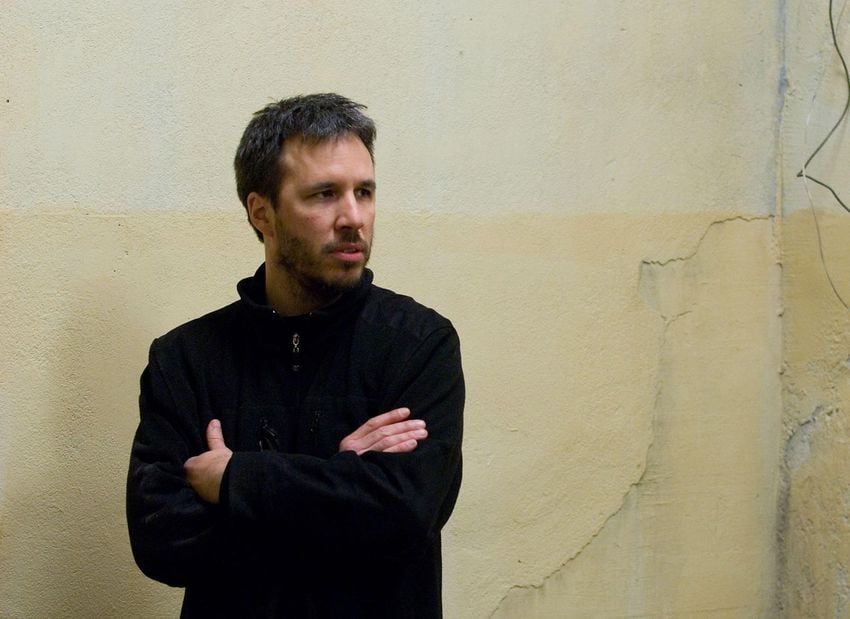
You are a GUI agent. You are given a task and a screenshot of the screen. Output one action in this format:
    pyautogui.click(x=<x>, y=<y>)
    Task: Click on the wires
    The height and width of the screenshot is (619, 850).
    Given the screenshot: What is the action you would take?
    pos(802,144), pos(836,197), pos(836,48)